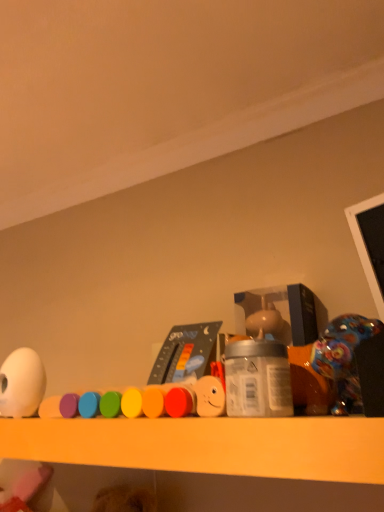
Locate an element on the screen. The height and width of the screenshot is (512, 384). smooth plastic toy at center, which is counted as the second toy, starting from the left is located at coordinates (176, 399).

Find the location of a particular element. shiny plastic toy at right, placed as the 1th toy when sorted from right to left is located at coordinates (352, 364).

From the white matte egg at left, arranged as the third toy when viewed from the right, count 2nd toy to the right and point to it. Please provide its 2D coordinates.

[(352, 364)]

Does white matte egg at left, which is the first toy from left to right, touch shiny plastic toy at right, arranged as the third toy when viewed from the left?

No, white matte egg at left, which is the first toy from left to right, is not touching shiny plastic toy at right, arranged as the third toy when viewed from the left.

Which of these two, white matte egg at left, which is the first toy from left to right, or shiny plastic toy at right, placed as the 1th toy when sorted from right to left, is bigger?

With larger size is shiny plastic toy at right, placed as the 1th toy when sorted from right to left.

Is white matte egg at left, arranged as the third toy when viewed from the right, located outside shiny plastic toy at right, arranged as the third toy when viewed from the left?

white matte egg at left, arranged as the third toy when viewed from the right, is positioned outside shiny plastic toy at right, arranged as the third toy when viewed from the left.

Is silver metallic jar at center positioned with its back to shiny plastic toy at right, arranged as the third toy when viewed from the left?

silver metallic jar at center is not turned away from shiny plastic toy at right, arranged as the third toy when viewed from the left.

Consider the image. Is silver metallic jar at center taller or shorter than shiny plastic toy at right, placed as the 1th toy when sorted from right to left?

A: In the image, silver metallic jar at center appears to be shorter than shiny plastic toy at right, placed as the 1th toy when sorted from right to left.

Is silver metallic jar at center at the left side of shiny plastic toy at right, placed as the 1th toy when sorted from right to left?

Yes, silver metallic jar at center is to the left of shiny plastic toy at right, placed as the 1th toy when sorted from right to left.

Measure the distance from silver metallic jar at center to shiny plastic toy at right, placed as the 1th toy when sorted from right to left.

A distance of 2.64 inches exists between silver metallic jar at center and shiny plastic toy at right, placed as the 1th toy when sorted from right to left.

Could you tell me if white matte egg at left, arranged as the third toy when viewed from the right, is turned towards smooth plastic toy at center, marked as the 2th toy in a right-to-left arrangement?

No, white matte egg at left, arranged as the third toy when viewed from the right, is not facing towards smooth plastic toy at center, marked as the 2th toy in a right-to-left arrangement.

The width and height of the screenshot is (384, 512). There is a smooth plastic toy at center, which is counted as the second toy, starting from the left. Identify the location of the 2nd toy above it (from a real-world perspective). (21, 384).

Is point (16, 354) closer or farther from the camera than point (147, 416)?

Clearly, point (16, 354) is more distant from the camera than point (147, 416).

Is white matte egg at left, which is the first toy from left to right, taller or shorter than smooth plastic toy at center, which is counted as the second toy, starting from the left?

Considering their sizes, white matte egg at left, which is the first toy from left to right, has more height than smooth plastic toy at center, which is counted as the second toy, starting from the left.

Considering the sizes of objects shiny plastic toy at right, arranged as the third toy when viewed from the left, and white matte egg at left, which is the first toy from left to right, in the image provided, who is bigger, shiny plastic toy at right, arranged as the third toy when viewed from the left, or white matte egg at left, which is the first toy from left to right,?

shiny plastic toy at right, arranged as the third toy when viewed from the left.

Considering the positions of objects shiny plastic toy at right, placed as the 1th toy when sorted from right to left, and white matte egg at left, arranged as the third toy when viewed from the right, in the image provided, who is more to the right, shiny plastic toy at right, placed as the 1th toy when sorted from right to left, or white matte egg at left, arranged as the third toy when viewed from the right,?

shiny plastic toy at right, placed as the 1th toy when sorted from right to left.

From their relative heights in the image, would you say shiny plastic toy at right, arranged as the third toy when viewed from the left, is taller or shorter than white matte egg at left, arranged as the third toy when viewed from the right?

shiny plastic toy at right, arranged as the third toy when viewed from the left, is shorter than white matte egg at left, arranged as the third toy when viewed from the right.

Is the depth of shiny plastic toy at right, arranged as the third toy when viewed from the left, less than that of white matte egg at left, which is the first toy from left to right?

Yes, shiny plastic toy at right, arranged as the third toy when viewed from the left, is closer to the viewer.

Does shiny plastic toy at right, arranged as the third toy when viewed from the left, touch silver metallic jar at center?

Yes, the surface of shiny plastic toy at right, arranged as the third toy when viewed from the left, is in contact with silver metallic jar at center.

From a real-world perspective, does shiny plastic toy at right, placed as the 1th toy when sorted from right to left, stand above silver metallic jar at center?

Yes, from a real-world perspective, shiny plastic toy at right, placed as the 1th toy when sorted from right to left, is above silver metallic jar at center.

Between shiny plastic toy at right, placed as the 1th toy when sorted from right to left, and silver metallic jar at center, which one appears on the left side from the viewer's perspective?

silver metallic jar at center.

Is silver metallic jar at center thinner than smooth plastic toy at center, which is counted as the second toy, starting from the left?

Incorrect, the width of silver metallic jar at center is not less than that of smooth plastic toy at center, which is counted as the second toy, starting from the left.

Is silver metallic jar at center oriented towards smooth plastic toy at center, marked as the 2th toy in a right-to-left arrangement?

No, silver metallic jar at center is not turned towards smooth plastic toy at center, marked as the 2th toy in a right-to-left arrangement.

Is silver metallic jar at center far away from smooth plastic toy at center, marked as the 2th toy in a right-to-left arrangement?

silver metallic jar at center is near smooth plastic toy at center, marked as the 2th toy in a right-to-left arrangement, not far away.

Measure the distance from silver metallic jar at center to smooth plastic toy at center, marked as the 2th toy in a right-to-left arrangement.

silver metallic jar at center and smooth plastic toy at center, marked as the 2th toy in a right-to-left arrangement, are 2.63 inches apart from each other.

Is smooth plastic toy at center, which is counted as the second toy, starting from the left, thinner than shiny plastic toy at right, arranged as the third toy when viewed from the left?

Yes, smooth plastic toy at center, which is counted as the second toy, starting from the left, is thinner than shiny plastic toy at right, arranged as the third toy when viewed from the left.

Considering the positions of objects smooth plastic toy at center, which is counted as the second toy, starting from the left, and shiny plastic toy at right, arranged as the third toy when viewed from the left, in the image provided, who is in front, smooth plastic toy at center, which is counted as the second toy, starting from the left, or shiny plastic toy at right, arranged as the third toy when viewed from the left,?

shiny plastic toy at right, arranged as the third toy when viewed from the left, is in front.

From the image's perspective, is smooth plastic toy at center, which is counted as the second toy, starting from the left, above shiny plastic toy at right, placed as the 1th toy when sorted from right to left?

Incorrect, from the image's perspective, smooth plastic toy at center, which is counted as the second toy, starting from the left, is lower than shiny plastic toy at right, placed as the 1th toy when sorted from right to left.

Is point (128, 412) more distant than point (383, 414)?

Yes, point (128, 412) is behind point (383, 414).

Where is `the 1st toy directly beneath the white matte egg at left, arranged as the third toy when viewed from the right (from a real-world perspective)`? the 1st toy directly beneath the white matte egg at left, arranged as the third toy when viewed from the right (from a real-world perspective) is located at coordinates (352, 364).

The image size is (384, 512). In order to click on bottle that is below the shiny plastic toy at right, placed as the 1th toy when sorted from right to left (from the image's perspective) in this screenshot , I will do `click(258, 379)`.

Estimate the real-world distances between objects in this image. Which object is further from shiny plastic toy at right, arranged as the third toy when viewed from the left, smooth plastic toy at center, which is counted as the second toy, starting from the left, or silver metallic jar at center?

Based on the image, smooth plastic toy at center, which is counted as the second toy, starting from the left, appears to be further to shiny plastic toy at right, arranged as the third toy when viewed from the left.

Considering their positions, is white matte egg at left, arranged as the third toy when viewed from the right, positioned closer to shiny plastic toy at right, placed as the 1th toy when sorted from right to left, than silver metallic jar at center?

silver metallic jar at center is positioned closer to the anchor shiny plastic toy at right, placed as the 1th toy when sorted from right to left.

Considering their positions, is silver metallic jar at center positioned further to smooth plastic toy at center, marked as the 2th toy in a right-to-left arrangement, than white matte egg at left, arranged as the third toy when viewed from the right?

The object further to smooth plastic toy at center, marked as the 2th toy in a right-to-left arrangement, is white matte egg at left, arranged as the third toy when viewed from the right.

Which object lies nearer to the anchor point shiny plastic toy at right, placed as the 1th toy when sorted from right to left, silver metallic jar at center or white matte egg at left, which is the first toy from left to right?

Based on the image, silver metallic jar at center appears to be nearer to shiny plastic toy at right, placed as the 1th toy when sorted from right to left.

When comparing their distances from silver metallic jar at center, does white matte egg at left, which is the first toy from left to right, or shiny plastic toy at right, arranged as the third toy when viewed from the left, seem further?

white matte egg at left, which is the first toy from left to right, lies further to silver metallic jar at center than the other object.

Based on their spatial positions, is smooth plastic toy at center, which is counted as the second toy, starting from the left, or shiny plastic toy at right, arranged as the third toy when viewed from the left, further from silver metallic jar at center?

shiny plastic toy at right, arranged as the third toy when viewed from the left, lies further to silver metallic jar at center than the other object.

Looking at this image, which object lies further to the anchor point white matte egg at left, which is the first toy from left to right, silver metallic jar at center or shiny plastic toy at right, placed as the 1th toy when sorted from right to left?

shiny plastic toy at right, placed as the 1th toy when sorted from right to left, is positioned further to the anchor white matte egg at left, which is the first toy from left to right.

Estimate the real-world distances between objects in this image. Which object is further from white matte egg at left, arranged as the third toy when viewed from the right, smooth plastic toy at center, marked as the 2th toy in a right-to-left arrangement, or shiny plastic toy at right, arranged as the third toy when viewed from the left?

shiny plastic toy at right, arranged as the third toy when viewed from the left, lies further to white matte egg at left, arranged as the third toy when viewed from the right, than the other object.

At what (x,y) coordinates should I click in order to perform the action: click on bottle between white matte egg at left, arranged as the third toy when viewed from the right, and shiny plastic toy at right, arranged as the third toy when viewed from the left, from left to right. Please return your answer as a coordinate pair (x, y). Image resolution: width=384 pixels, height=512 pixels. Looking at the image, I should click on (258, 379).

At what (x,y) coordinates should I click in order to perform the action: click on toy situated between white matte egg at left, arranged as the third toy when viewed from the right, and silver metallic jar at center from left to right. Please return your answer as a coordinate pair (x, y). Looking at the image, I should click on (176, 399).

Find the location of a particular element. The image size is (384, 512). bottle between smooth plastic toy at center, marked as the 2th toy in a right-to-left arrangement, and shiny plastic toy at right, arranged as the third toy when viewed from the left is located at coordinates (258, 379).

What are the coordinates of `toy between white matte egg at left, arranged as the third toy when viewed from the right, and shiny plastic toy at right, placed as the 1th toy when sorted from right to left, in the horizontal direction` in the screenshot? It's located at (176, 399).